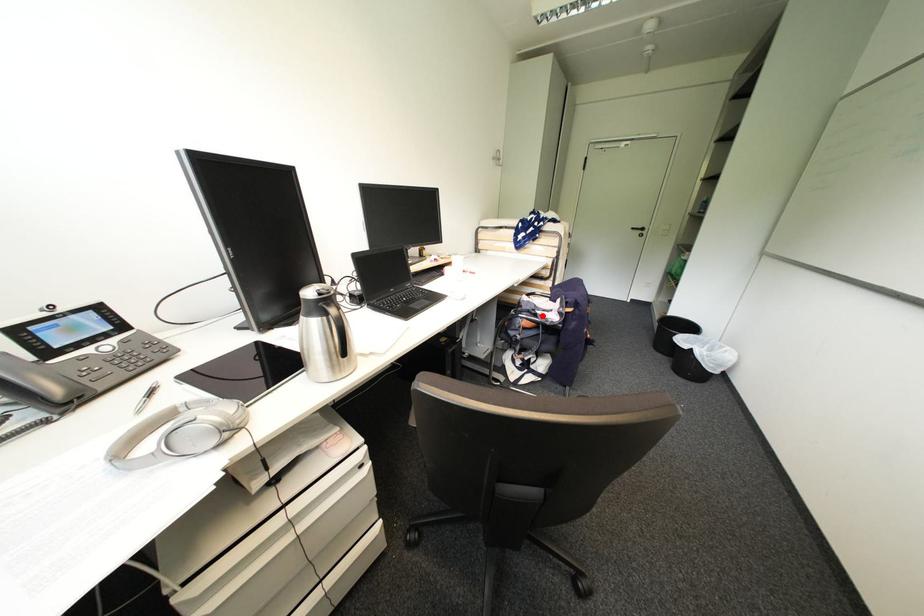
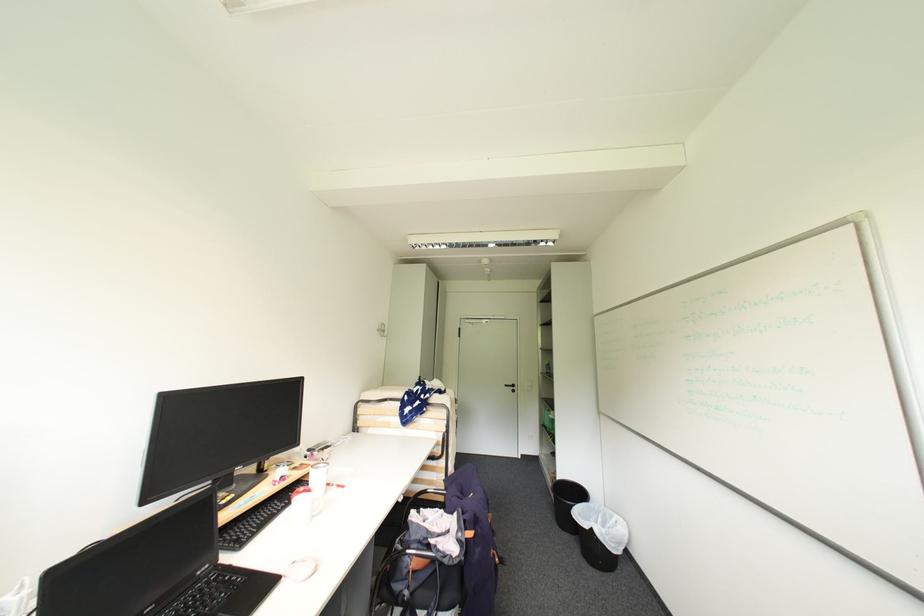
The point at the highlighted location is marked in the first image. Where is the corresponding point in the second image?

(435, 548)